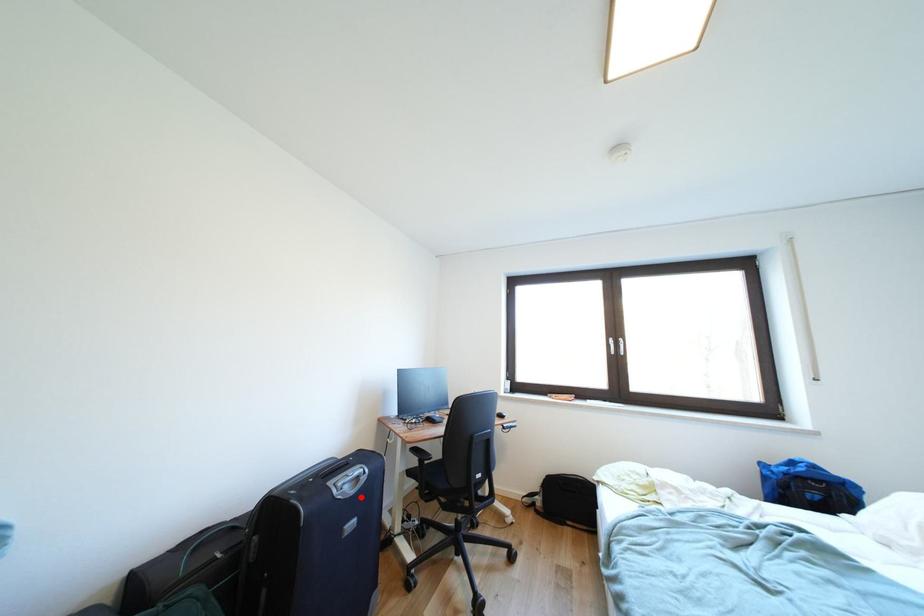
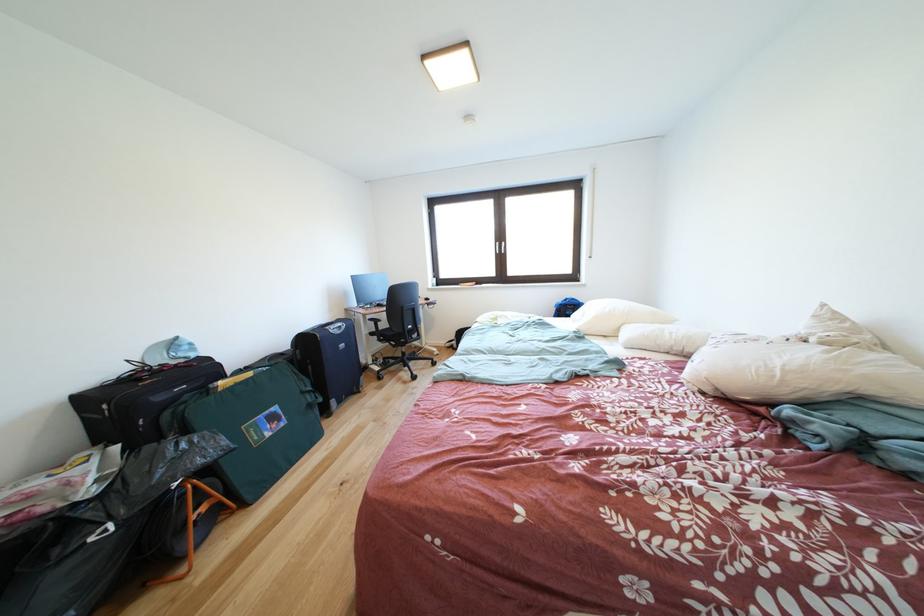
Where in the second image is the point corresponding to the highlighted location from the first image?

(347, 337)